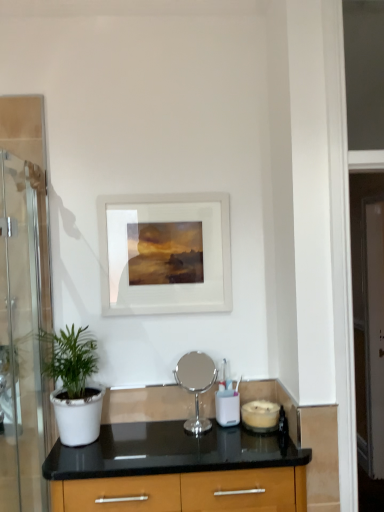
This screenshot has height=512, width=384. What do you see at coordinates (260, 416) in the screenshot?
I see `matte glass candle at lower right, the first appliance when ordered from right to left` at bounding box center [260, 416].

You are a GUI agent. You are given a task and a screenshot of the screen. Output one action in this format:
    pyautogui.click(x=<x>, y=<y>)
    Task: Click on the matte glass candle at lower right, the 2th appliance positioned from the left
    Image resolution: width=384 pixels, height=512 pixels.
    Given the screenshot: What is the action you would take?
    pyautogui.click(x=260, y=416)

This screenshot has height=512, width=384. I want to click on green matte plant at left, so coord(74,385).

Find the location of a particular element. Image resolution: width=384 pixels, height=512 pixels. transparent glass screen door at left, the second screen door viewed from the back is located at coordinates [x=23, y=305].

Measure the distance between white glossy screen door at right, which appears as the 1th screen door when viewed from the back, and camera.

They are 7.17 feet apart.

What do you see at coordinates (165, 253) in the screenshot? Image resolution: width=384 pixels, height=512 pixels. I see `white matte picture frame at center` at bounding box center [165, 253].

Identify the location of silver metallic mirror at center, marked as the second appliance in a right-to-left arrangement. This screenshot has height=512, width=384. (196, 385).

Does white glossy screen door at right, which appears as the 1th screen door when viewed from the back, have a greater width compared to transparent glass screen door at left, the second screen door viewed from the back?

No, white glossy screen door at right, which appears as the 1th screen door when viewed from the back, is not wider than transparent glass screen door at left, the second screen door viewed from the back.

Considering the sizes of objects white glossy screen door at right, which is the 2th screen door in front-to-back order, and transparent glass screen door at left, positioned as the second screen door in right-to-left order, in the image provided, who is taller, white glossy screen door at right, which is the 2th screen door in front-to-back order, or transparent glass screen door at left, positioned as the second screen door in right-to-left order,?

white glossy screen door at right, which is the 2th screen door in front-to-back order, is taller.

Which is correct: white glossy screen door at right, which appears as the second screen door when viewed from the left, is inside transparent glass screen door at left, placed as the first screen door when sorted from left to right, or outside of it?

white glossy screen door at right, which appears as the second screen door when viewed from the left, exists outside the volume of transparent glass screen door at left, placed as the first screen door when sorted from left to right.

The width and height of the screenshot is (384, 512). What are the coordinates of `screen door that appears above the white glossy screen door at right, which appears as the second screen door when viewed from the left (from a real-world perspective)` in the screenshot? It's located at (23, 305).

Considering the sizes of transparent glass screen door at left, acting as the 1th screen door starting from the front, and matte glass candle at lower right, the 2th appliance positioned from the left, in the image, is transparent glass screen door at left, acting as the 1th screen door starting from the front, bigger or smaller than matte glass candle at lower right, the 2th appliance positioned from the left,?

In the image, transparent glass screen door at left, acting as the 1th screen door starting from the front, appears to be larger than matte glass candle at lower right, the 2th appliance positioned from the left.

Is transparent glass screen door at left, positioned as the second screen door in right-to-left order, spatially inside matte glass candle at lower right, the first appliance when ordered from right to left, or outside of it?

transparent glass screen door at left, positioned as the second screen door in right-to-left order, is spatially situated outside matte glass candle at lower right, the first appliance when ordered from right to left.

Is transparent glass screen door at left, acting as the 1th screen door starting from the front, positioned far away from matte glass candle at lower right, the first appliance when ordered from right to left?

transparent glass screen door at left, acting as the 1th screen door starting from the front, is near matte glass candle at lower right, the first appliance when ordered from right to left, not far away.

Is white glossy screen door at right, which appears as the 1th screen door when viewed from the back, positioned with its back to green matte plant at left?

No, white glossy screen door at right, which appears as the 1th screen door when viewed from the back,'s orientation is not away from green matte plant at left.

You are a GUI agent. You are given a task and a screenshot of the screen. Output one action in this format:
    pyautogui.click(x=<x>, y=<y>)
    Task: Click on the screen door below the green matte plant at left (from a real-world perspective)
    
    Given the screenshot: What is the action you would take?
    pyautogui.click(x=368, y=315)

How different are the orientations of white glossy screen door at right, which appears as the 1th screen door when viewed from the back, and green matte plant at left in degrees?

92.1 degrees.

Is the position of white glossy screen door at right, which is the 2th screen door in front-to-back order, more distant than that of green matte plant at left?

Yes, white glossy screen door at right, which is the 2th screen door in front-to-back order, is further from the viewer.

Does matte glass candle at lower right, the 2th appliance positioned from the left, have a smaller size compared to green matte plant at left?

Indeed, matte glass candle at lower right, the 2th appliance positioned from the left, has a smaller size compared to green matte plant at left.

From a real-world perspective, is matte glass candle at lower right, the 2th appliance positioned from the left, positioned under green matte plant at left based on gravity?

Yes.

Which object is positioned more to the right, matte glass candle at lower right, the first appliance when ordered from right to left, or green matte plant at left?

matte glass candle at lower right, the first appliance when ordered from right to left.

Is matte glass candle at lower right, the 2th appliance positioned from the left, thinner than green matte plant at left?

Correct, the width of matte glass candle at lower right, the 2th appliance positioned from the left, is less than that of green matte plant at left.

Between matte glass candle at lower right, the first appliance when ordered from right to left, and white matte picture frame at center, which one appears on the left side from the viewer's perspective?

white matte picture frame at center.

What's the angular difference between matte glass candle at lower right, the 2th appliance positioned from the left, and white matte picture frame at center's facing directions?

0.748 degrees separate the facing orientations of matte glass candle at lower right, the 2th appliance positioned from the left, and white matte picture frame at center.

Can we say matte glass candle at lower right, the first appliance when ordered from right to left, lies outside white matte picture frame at center?

Yes, matte glass candle at lower right, the first appliance when ordered from right to left, is located beyond the bounds of white matte picture frame at center.

From the image's perspective, does matte glass candle at lower right, the first appliance when ordered from right to left, appear lower than white matte picture frame at center?

Yes, from the image's perspective, matte glass candle at lower right, the first appliance when ordered from right to left, is beneath white matte picture frame at center.

Is white glossy screen door at right, which appears as the second screen door when viewed from the left, touching matte glass candle at lower right, the 2th appliance positioned from the left?

No, white glossy screen door at right, which appears as the second screen door when viewed from the left, is not next to matte glass candle at lower right, the 2th appliance positioned from the left.

Based on the photo, is white glossy screen door at right, which appears as the second screen door when viewed from the left, aimed at matte glass candle at lower right, the 2th appliance positioned from the left?

No, white glossy screen door at right, which appears as the second screen door when viewed from the left, is not turned towards matte glass candle at lower right, the 2th appliance positioned from the left.

From a real-world perspective, which is physically below, white glossy screen door at right, arranged as the 1th screen door when viewed from the right, or matte glass candle at lower right, the 2th appliance positioned from the left?

white glossy screen door at right, arranged as the 1th screen door when viewed from the right.

Does point (361, 371) lie behind point (277, 425)?

That is True.

Is white matte picture frame at center facing towards matte glass candle at lower right, the 2th appliance positioned from the left?

No.

In the image, is white matte picture frame at center positioned in front of or behind matte glass candle at lower right, the 2th appliance positioned from the left?

Clearly, white matte picture frame at center is behind matte glass candle at lower right, the 2th appliance positioned from the left.

Is white matte picture frame at center next to matte glass candle at lower right, the 2th appliance positioned from the left, and touching it?

No, white matte picture frame at center is not touching matte glass candle at lower right, the 2th appliance positioned from the left.

From a real-world perspective, is white matte picture frame at center above or below matte glass candle at lower right, the 2th appliance positioned from the left?

white matte picture frame at center is above matte glass candle at lower right, the 2th appliance positioned from the left.

At what (x,y) coordinates should I click in order to perform the action: click on screen door above the white glossy screen door at right, which is the 2th screen door in front-to-back order (from the image's perspective). Please return your answer as a coordinate pair (x, y). This screenshot has width=384, height=512. Looking at the image, I should click on (23, 305).

From the image's perspective, which appliance is the 2nd one below the transparent glass screen door at left, positioned as the second screen door in right-to-left order? Please provide its 2D coordinates.

[(260, 416)]

Which object lies nearer to the anchor point silver metallic mirror at center, the first appliance in the left-to-right sequence, white matte picture frame at center or green matte plant at left?

green matte plant at left.

From the image, which object appears to be farther from silver metallic mirror at center, the first appliance in the left-to-right sequence, white matte picture frame at center or matte glass candle at lower right, the first appliance when ordered from right to left?

white matte picture frame at center is further to silver metallic mirror at center, the first appliance in the left-to-right sequence.

When comparing their distances from green matte plant at left, does silver metallic mirror at center, marked as the second appliance in a right-to-left arrangement, or transparent glass screen door at left, acting as the 1th screen door starting from the front, seem closer?

The object closer to green matte plant at left is transparent glass screen door at left, acting as the 1th screen door starting from the front.

Based on their spatial positions, is green matte plant at left or white glossy screen door at right, which appears as the 1th screen door when viewed from the back, closer to transparent glass screen door at left, acting as the 1th screen door starting from the front?

Based on the image, green matte plant at left appears to be nearer to transparent glass screen door at left, acting as the 1th screen door starting from the front.

Estimate the real-world distances between objects in this image. Which object is further from white matte picture frame at center, white glossy screen door at right, which appears as the 1th screen door when viewed from the back, or silver metallic mirror at center, the first appliance in the left-to-right sequence?

white glossy screen door at right, which appears as the 1th screen door when viewed from the back, lies further to white matte picture frame at center than the other object.

Which object lies further to the anchor point white glossy screen door at right, which appears as the second screen door when viewed from the left, transparent glass screen door at left, the second screen door viewed from the back, or matte glass candle at lower right, the first appliance when ordered from right to left?

The object further to white glossy screen door at right, which appears as the second screen door when viewed from the left, is transparent glass screen door at left, the second screen door viewed from the back.

Based on the photo, estimate the real-world distances between objects in this image. Which object is further from white glossy screen door at right, which appears as the second screen door when viewed from the left, green matte plant at left or transparent glass screen door at left, the second screen door viewed from the back?

transparent glass screen door at left, the second screen door viewed from the back.

Estimate the real-world distances between objects in this image. Which object is further from silver metallic mirror at center, marked as the second appliance in a right-to-left arrangement, transparent glass screen door at left, positioned as the second screen door in right-to-left order, or white matte picture frame at center?

transparent glass screen door at left, positioned as the second screen door in right-to-left order, is positioned further to the anchor silver metallic mirror at center, marked as the second appliance in a right-to-left arrangement.

Where is `picture frame between green matte plant at left and white glossy screen door at right, which appears as the 1th screen door when viewed from the back, from left to right`? The height and width of the screenshot is (512, 384). picture frame between green matte plant at left and white glossy screen door at right, which appears as the 1th screen door when viewed from the back, from left to right is located at coordinates (165, 253).

Identify the location of appliance situated between green matte plant at left and matte glass candle at lower right, the first appliance when ordered from right to left, from left to right. Image resolution: width=384 pixels, height=512 pixels. (196, 385).

Find the location of a particular element. picture frame between transparent glass screen door at left, the second screen door viewed from the back, and white glossy screen door at right, arranged as the 1th screen door when viewed from the right, from left to right is located at coordinates (165, 253).

Image resolution: width=384 pixels, height=512 pixels. I want to click on picture frame between transparent glass screen door at left, acting as the 1th screen door starting from the front, and matte glass candle at lower right, the 2th appliance positioned from the left, in the horizontal direction, so click(165, 253).